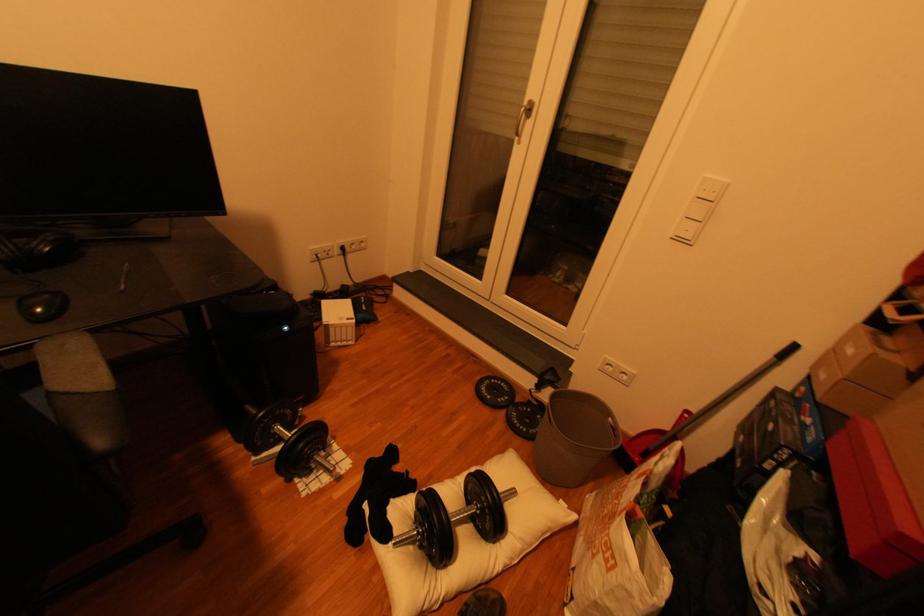
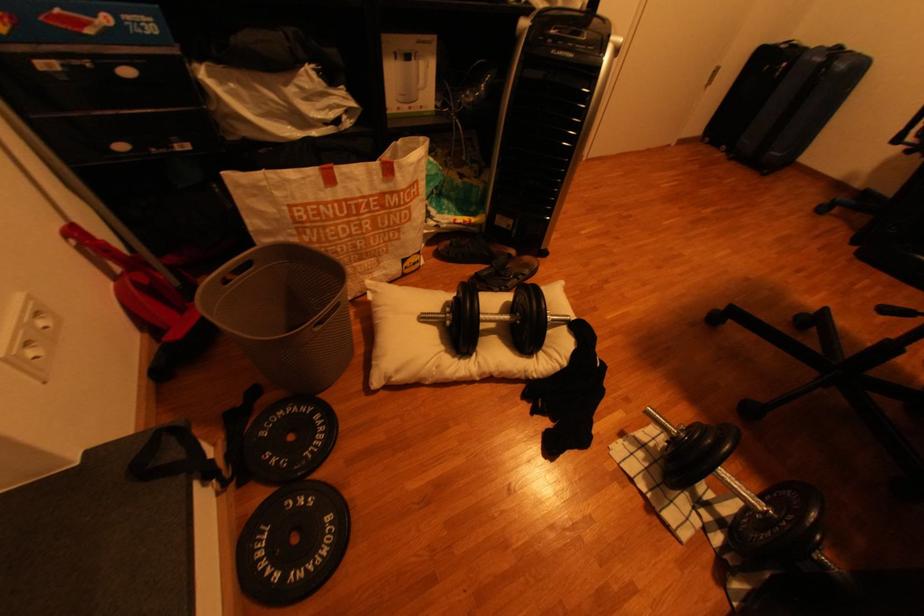
Where in the second image is the point corresponding to point (521, 493) from the first image?

(433, 318)